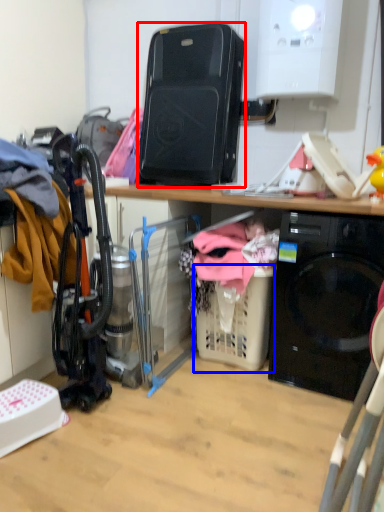
Question: Which object is further to the camera taking this photo, appliance (highlighted by a red box) or basket (highlighted by a blue box)?

Choices:
 (A) appliance
 (B) basket

Answer: (A)